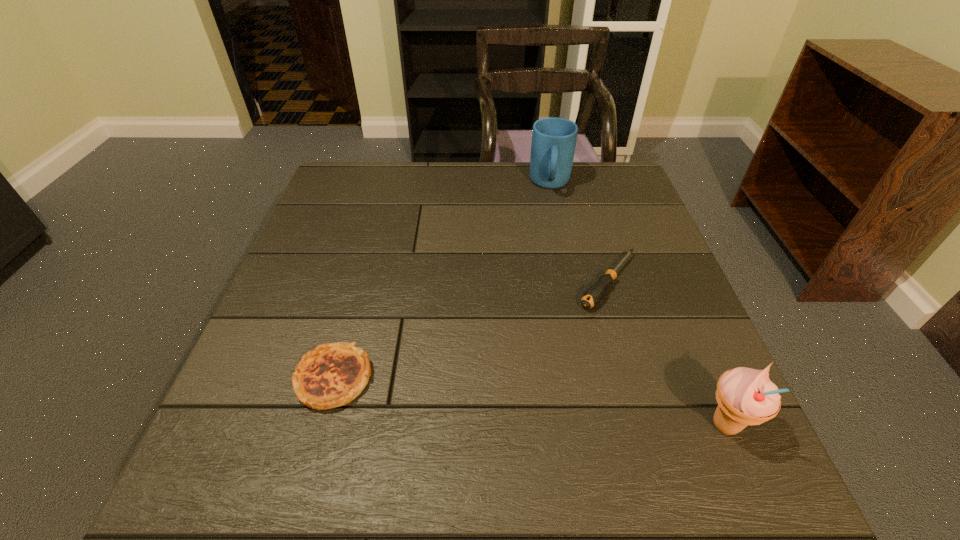
Locate an element on the screen. The width and height of the screenshot is (960, 540). free space that is in between the mug and the screwdriver is located at coordinates (579, 233).

Where is `vacant area between the second farthest object and the mug`? vacant area between the second farthest object and the mug is located at coordinates (579, 233).

At what (x,y) coordinates should I click in order to perform the action: click on free space between the third nearest object and the rightmost object. Please return your answer as a coordinate pair (x, y). This screenshot has width=960, height=540. Looking at the image, I should click on click(x=666, y=353).

This screenshot has height=540, width=960. I want to click on free space between the farthest object and the icecream, so click(x=637, y=305).

This screenshot has width=960, height=540. I want to click on vacant space that's between the farthest object and the leftmost object, so click(x=443, y=281).

I want to click on empty space that is in between the farthest object and the rightmost object, so click(x=637, y=305).

Where is `object that stands as the third closest to the farthest object`? This screenshot has height=540, width=960. object that stands as the third closest to the farthest object is located at coordinates (745, 396).

Identify which object is the second nearest to the farthest object. Please provide its 2D coordinates. Your answer should be formatted as a tuple, i.e. [(x, y)], where the tuple contains the x and y coordinates of a point satisfying the conditions above.

[(333, 374)]

In order to click on vacant space that satisfies the following two spatial constraints: 1. on the front side of the mug; 2. on the left side of the second farthest object in this screenshot , I will do point(570,282).

You are a GUI agent. You are given a task and a screenshot of the screen. Output one action in this format:
    pyautogui.click(x=<x>, y=<y>)
    Task: Click on the free spot that satisfies the following two spatial constraints: 1. on the front side of the quiche; 2. on the left side of the icecream
    
    Given the screenshot: What is the action you would take?
    pyautogui.click(x=321, y=425)